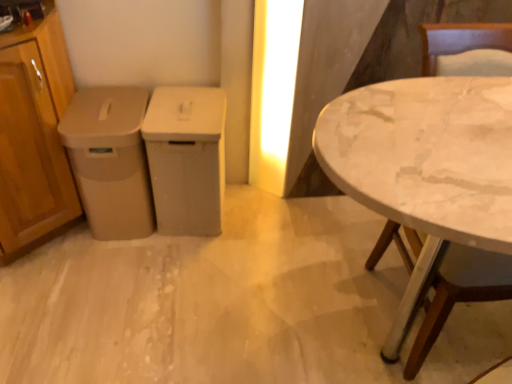
Find the location of `free space in front of beige plastic trash can at left, the 2th cabinetry when ordered from left to right`. free space in front of beige plastic trash can at left, the 2th cabinetry when ordered from left to right is located at coordinates (121, 270).